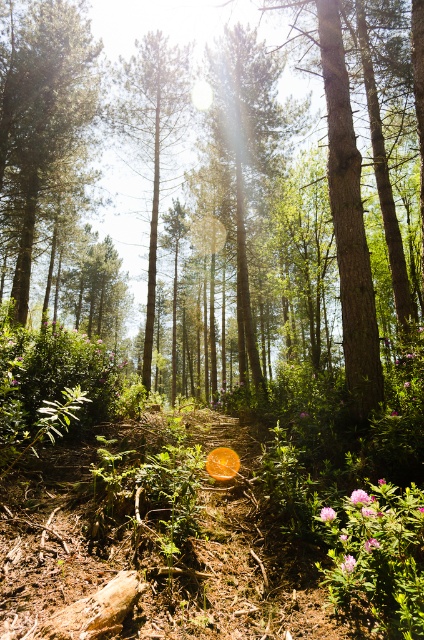
Question: Which of the following is the closest to the observer?

Choices:
 (A) (72, 163)
 (B) (243, 259)

Answer: (B)

Question: From the image, what is the correct spatial relationship of green leafy tree at center in relation to smooth brown tree trunk at center?

Choices:
 (A) above
 (B) below

Answer: (B)

Question: Which point appears closest to the camera in this image?

Choices:
 (A) (127, 88)
 (B) (11, 154)
 (C) (222, 100)

Answer: (B)

Question: Observing the image, what is the correct spatial positioning of green matte tree at center in reference to green leafy tree at center?

Choices:
 (A) above
 (B) below

Answer: (A)

Question: Can you confirm if green matte tree at center is wider than smooth brown tree trunk at center?

Choices:
 (A) no
 (B) yes

Answer: (B)

Question: Among these objects, which one is farthest from the camera?

Choices:
 (A) green leafy tree at center
 (B) green matte tree at center

Answer: (B)